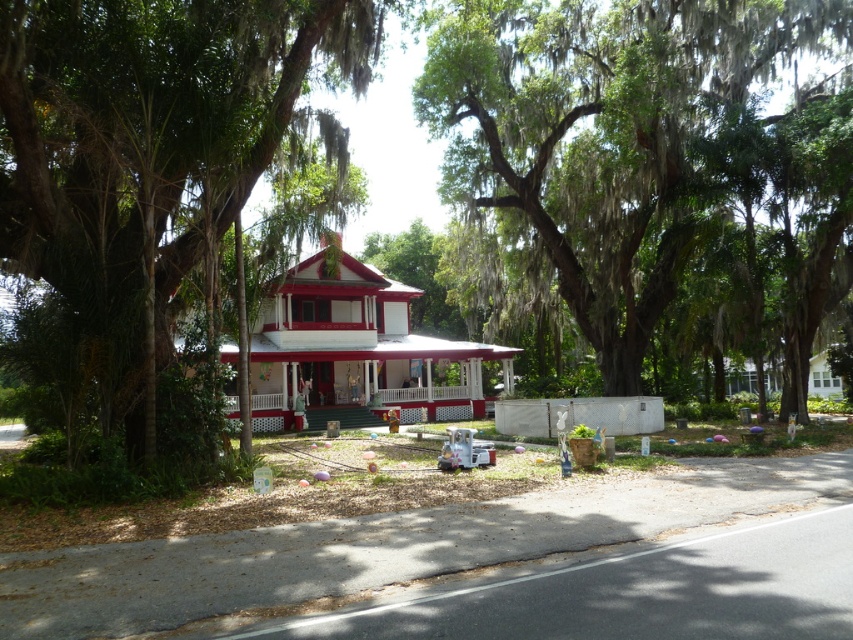
Question: Is green mossy tree at center closer to the viewer compared to white painted wood gazebo at center?

Choices:
 (A) yes
 (B) no

Answer: (B)

Question: Which point is closer to the camera?

Choices:
 (A) white painted wood porch at center
 (B) green leafy tree at center
 (C) green mossy tree at center

Answer: (B)

Question: Which is farther from the green mossy tree at center?

Choices:
 (A) white painted wood gazebo at center
 (B) green leafy tree at center

Answer: (B)

Question: Among these points, which one is nearest to the camera?

Choices:
 (A) (233, 200)
 (B) (460, 410)

Answer: (A)

Question: Is green mossy tree at center smaller than green leafy tree at center?

Choices:
 (A) yes
 (B) no

Answer: (B)

Question: Does green leafy tree at center appear over white painted wood porch at center?

Choices:
 (A) no
 (B) yes

Answer: (B)